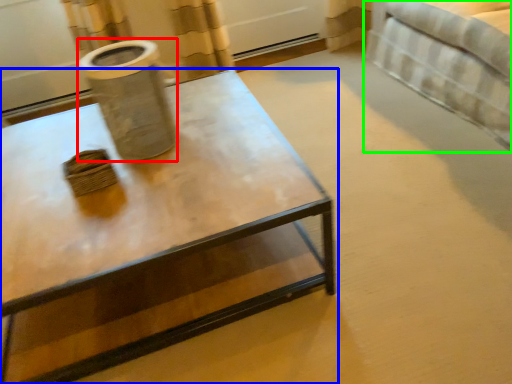
Question: Which object is positioned closest to vase (highlighted by a red box)? Select from coffee table (highlighted by a blue box) and bed (highlighted by a green box).

Choices:
 (A) coffee table
 (B) bed

Answer: (A)